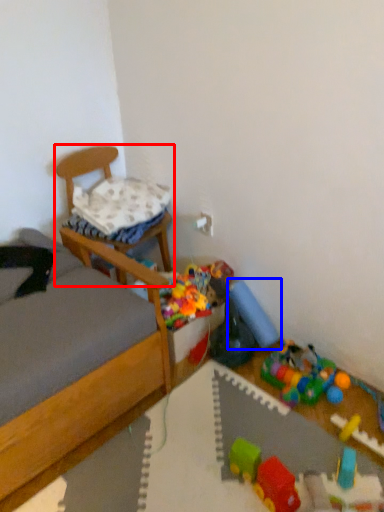
Question: Which point is further to the camera, chair (highlighted by a red box) or toy (highlighted by a blue box)?

Choices:
 (A) chair
 (B) toy

Answer: (B)